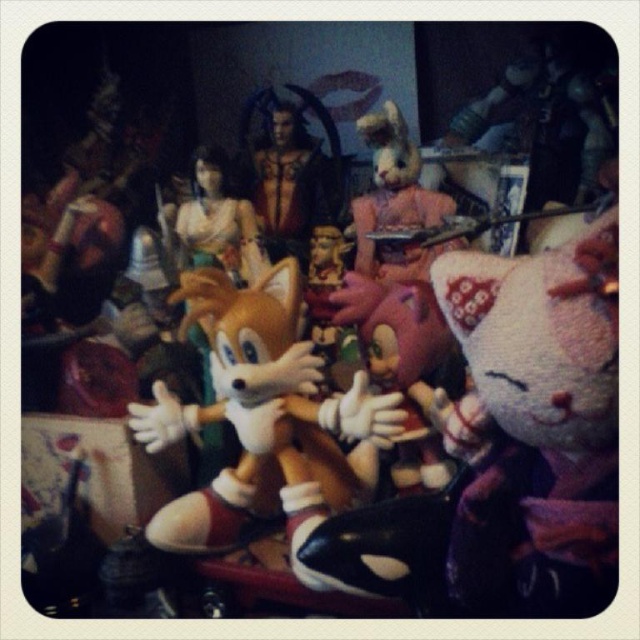
Question: Is fluffy orange fox at center below fuzzy pink bunny at center?

Choices:
 (A) no
 (B) yes

Answer: (B)

Question: Can you confirm if fluffy orange fox at center is positioned to the right of fuzzy pink bunny at center?

Choices:
 (A) yes
 (B) no

Answer: (B)

Question: Can you confirm if fluffy orange fox at center is positioned to the left of fuzzy pink bunny at center?

Choices:
 (A) yes
 (B) no

Answer: (A)

Question: Which object appears farthest from the camera in this image?

Choices:
 (A) fuzzy pink bunny at center
 (B) fluffy orange fox at center

Answer: (A)

Question: Which point is farther to the camera?

Choices:
 (A) (253, 476)
 (B) (448, 198)

Answer: (B)

Question: Which point is farther to the camera?

Choices:
 (A) (292, 266)
 (B) (388, 170)

Answer: (B)